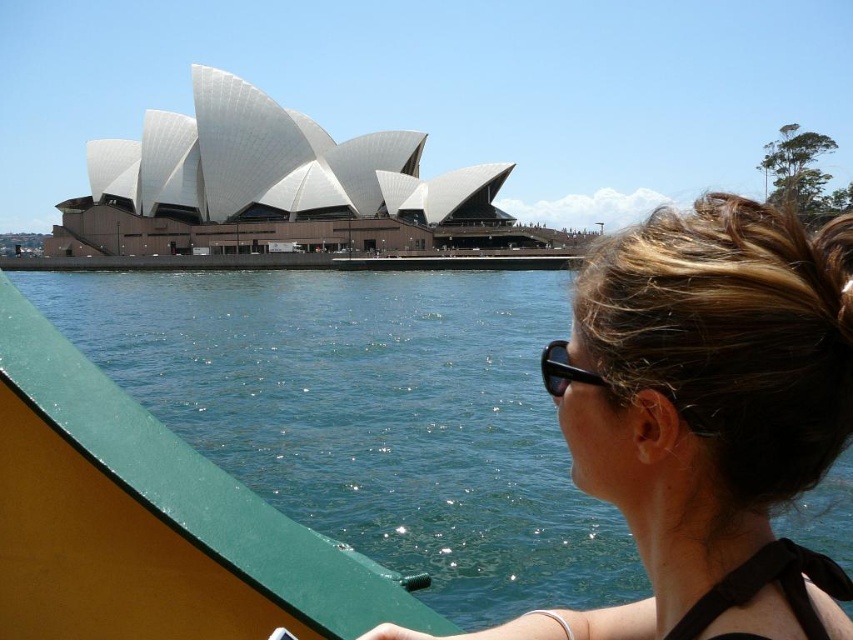
Question: Which object is the farthest from the blonde hair bun at center?

Choices:
 (A) black plastic goggles at upper right
 (B) black plastic sunglasses at upper right

Answer: (B)

Question: Which point is farther to the camera?

Choices:
 (A) black plastic sunglasses at upper right
 (B) black plastic goggles at upper right
 (C) blonde hair bun at center

Answer: (A)

Question: Does blonde hair bun at center appear on the right side of black plastic sunglasses at upper right?

Choices:
 (A) yes
 (B) no

Answer: (A)

Question: Is black plastic goggles at upper right further to the viewer compared to black plastic sunglasses at upper right?

Choices:
 (A) yes
 (B) no

Answer: (B)

Question: Which point appears farthest from the camera in this image?

Choices:
 (A) (538, 364)
 (B) (772, 429)

Answer: (A)

Question: Does blonde hair bun at center have a greater width compared to black plastic sunglasses at upper right?

Choices:
 (A) no
 (B) yes

Answer: (B)